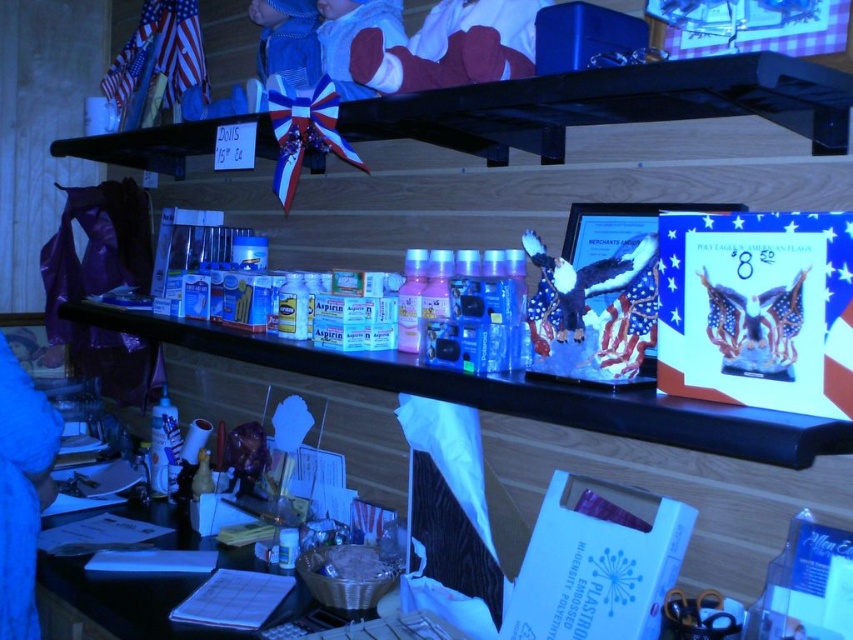
Which is below, soft cotton baby at upper center or fuzzy fabric eagle at center?

fuzzy fabric eagle at center is lower down.

Who is higher up, soft cotton baby at upper center or fuzzy fabric eagle at center?

Positioned higher is soft cotton baby at upper center.

Who is more forward, (368, 29) or (633, 272)?

Positioned in front is point (633, 272).

You are a GUI agent. You are given a task and a screenshot of the screen. Output one action in this format:
    pyautogui.click(x=<x>, y=<y>)
    Task: Click on the soft cotton baby at upper center
    The width and height of the screenshot is (853, 640).
    Given the screenshot: What is the action you would take?
    pyautogui.click(x=445, y=48)